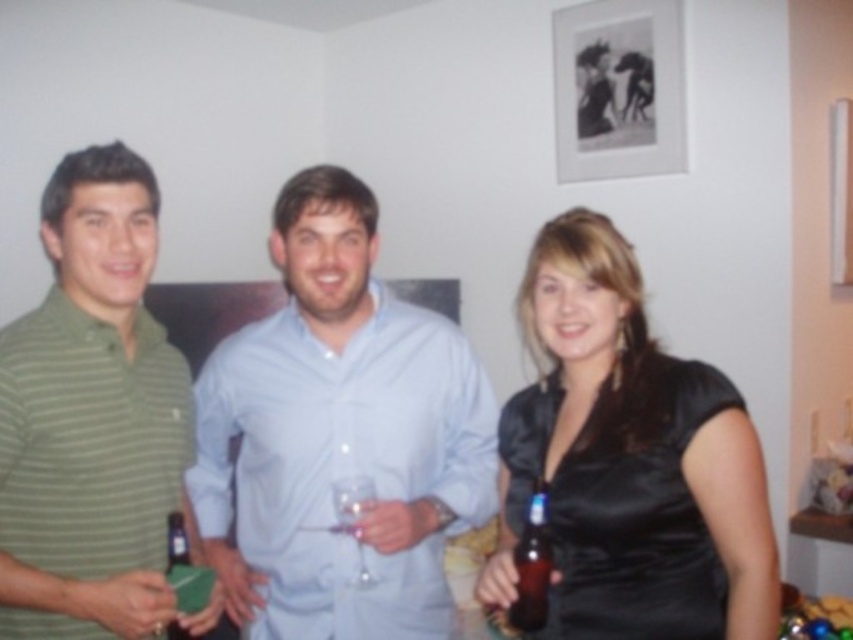
Question: From the image, what is the correct spatial relationship of black paper at upper center in relation to translucent plastic bottle at lower left?

Choices:
 (A) above
 (B) below

Answer: (A)

Question: Which point appears farthest from the camera in this image?

Choices:
 (A) (596, 134)
 (B) (48, 513)

Answer: (A)

Question: Which of the following is the closest to the observer?

Choices:
 (A) brown glass bottle at center
 (B) translucent plastic bottle at lower left

Answer: (A)

Question: Is light blue shirt at center bigger than black paper at upper center?

Choices:
 (A) yes
 (B) no

Answer: (A)

Question: Does light blue shirt at center have a greater width compared to satin black dress at center?

Choices:
 (A) yes
 (B) no

Answer: (A)

Question: Considering the real-world distances, which object is closest to the brown glass bottle at center?

Choices:
 (A) green striped polo shirt at left
 (B) black paper at upper center

Answer: (A)